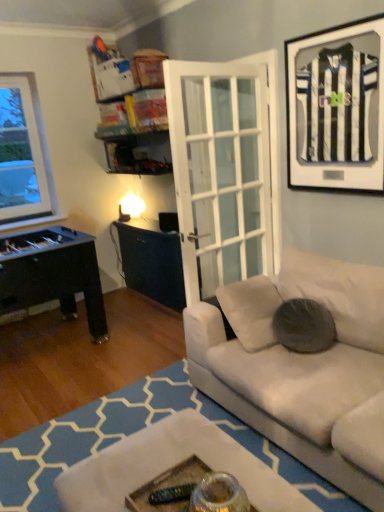
Question: Considering the positions of matte black jersey at upper right and dark gray fabric pillow at center in the image, is matte black jersey at upper right bigger or smaller than dark gray fabric pillow at center?

Choices:
 (A) big
 (B) small

Answer: (B)

Question: Does point (339, 44) appear closer or farther from the camera than point (299, 320)?

Choices:
 (A) closer
 (B) farther

Answer: (A)

Question: From their relative heights in the image, would you say matte black jersey at upper right is taller or shorter than dark gray fabric pillow at center?

Choices:
 (A) tall
 (B) short

Answer: (A)

Question: Is dark gray fabric pillow at center inside the boundaries of matte black jersey at upper right, or outside?

Choices:
 (A) inside
 (B) outside

Answer: (B)

Question: Would you say dark gray fabric pillow at center is to the left or to the right of matte black jersey at upper right in the picture?

Choices:
 (A) left
 (B) right

Answer: (A)

Question: Is dark gray fabric pillow at center in front of or behind matte black jersey at upper right in the image?

Choices:
 (A) behind
 (B) front

Answer: (A)

Question: Considering the positions of point (296, 349) and point (360, 36), is point (296, 349) closer or farther from the camera than point (360, 36)?

Choices:
 (A) closer
 (B) farther

Answer: (B)